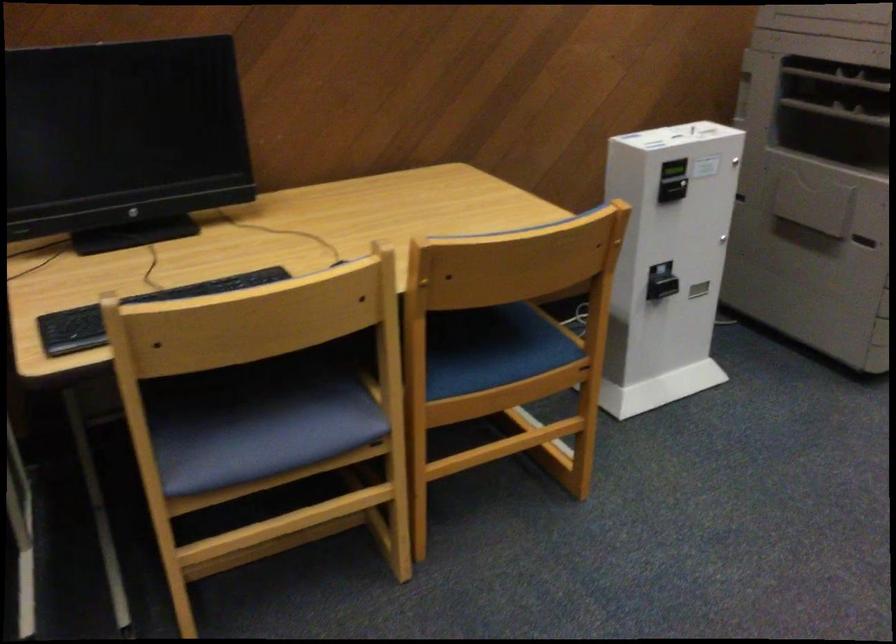
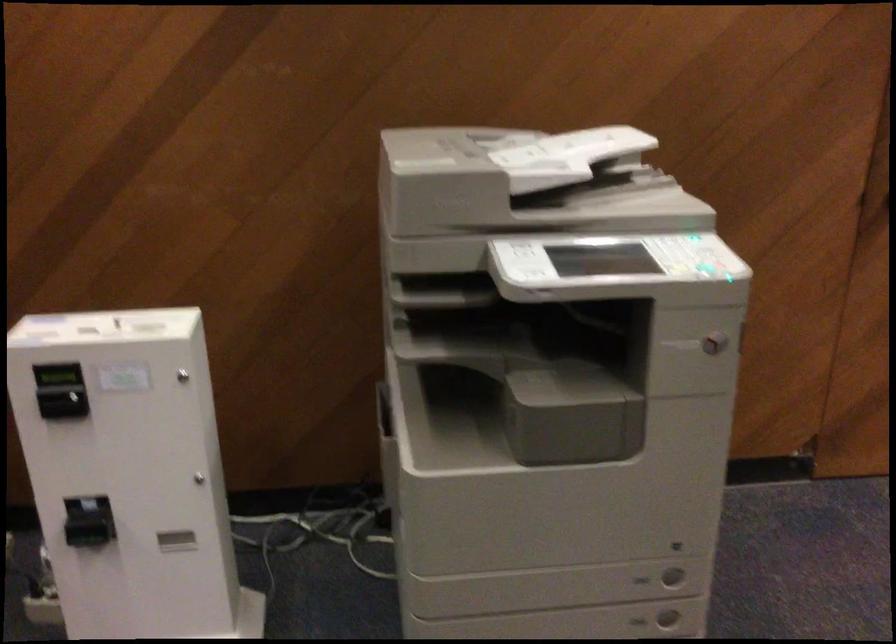
The images are taken continuously from a first-person perspective. In which direction are you moving?

The cameraman walked toward right, forward.